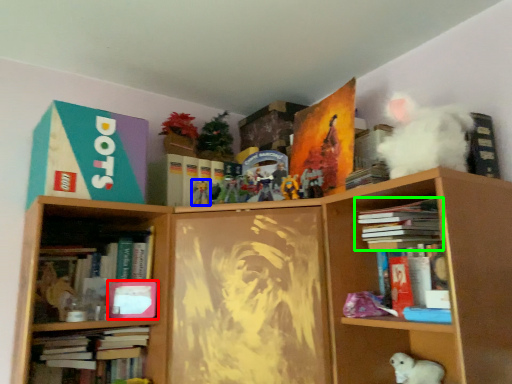
Question: Based on their relative distances, which object is farther from book cover (highlighted by a red box)? Choose from toy (highlighted by a blue box) and book (highlighted by a green box).

Choices:
 (A) toy
 (B) book

Answer: (B)